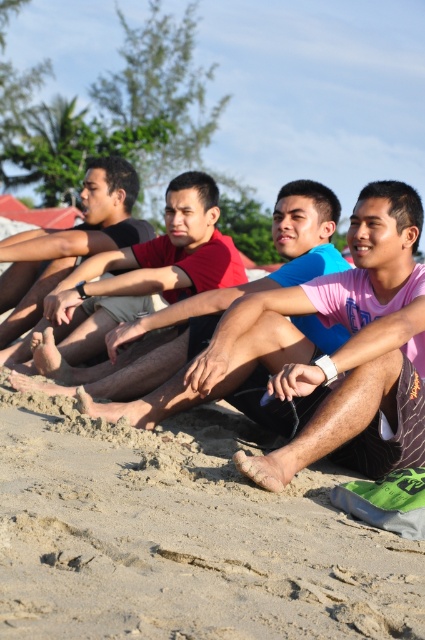
You are standing at the point marked by coordinates point (183,536). Which object from the scene are you currently standing on?

You are standing on the sandy beach at lower center, as the coordinates point (183,536) corresponds to the sandy beach at lower center.

You are standing on the sandy beach at lower center and want to reach the red shirt at center. In which direction should you move?

The sandy beach at lower center is positioned on the right side of red shirt at center, so you should move to the left to reach the red shirt at center.